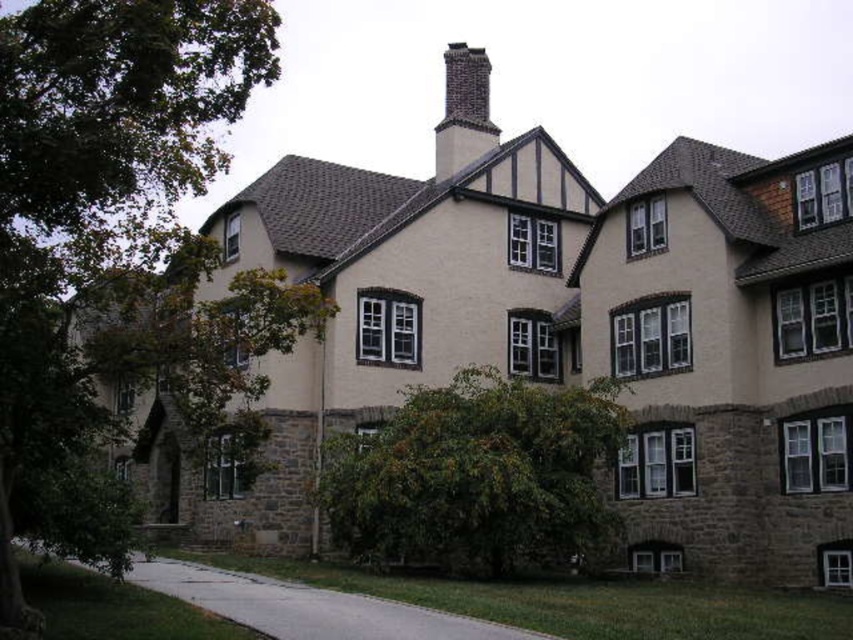
In order to click on green leafy tree at left in this screenshot , I will do `click(99, 179)`.

Who is more forward, (125, 243) or (461, 99)?

Point (125, 243)

Which is in front, point (28, 388) or point (440, 170)?

Point (28, 388)

The width and height of the screenshot is (853, 640). I want to click on green leafy tree at left, so click(x=99, y=179).

Measure the distance between gray concrete driveway at lower center and dark gray brick chimney at upper center.

The distance of gray concrete driveway at lower center from dark gray brick chimney at upper center is 49.57 meters.

Can you confirm if gray concrete driveway at lower center is wider than dark gray brick chimney at upper center?

Correct, the width of gray concrete driveway at lower center exceeds that of dark gray brick chimney at upper center.

Locate an element on the screen. This screenshot has height=640, width=853. gray concrete driveway at lower center is located at coordinates (309, 605).

Can you confirm if green leafy tree at left is wider than green leafy bush at center?

Indeed, green leafy tree at left has a greater width compared to green leafy bush at center.

Is green leafy tree at left closer to camera compared to green leafy bush at center?

Yes, green leafy tree at left is closer to the viewer.

What do you see at coordinates (99, 179) in the screenshot? The height and width of the screenshot is (640, 853). I see `green leafy tree at left` at bounding box center [99, 179].

The image size is (853, 640). Find the location of `green leafy tree at left`. green leafy tree at left is located at coordinates (99, 179).